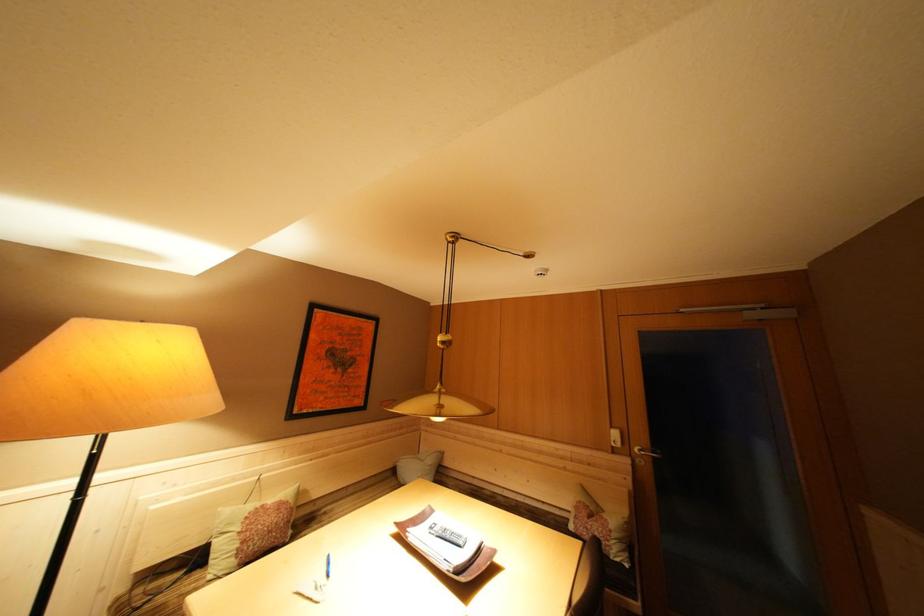
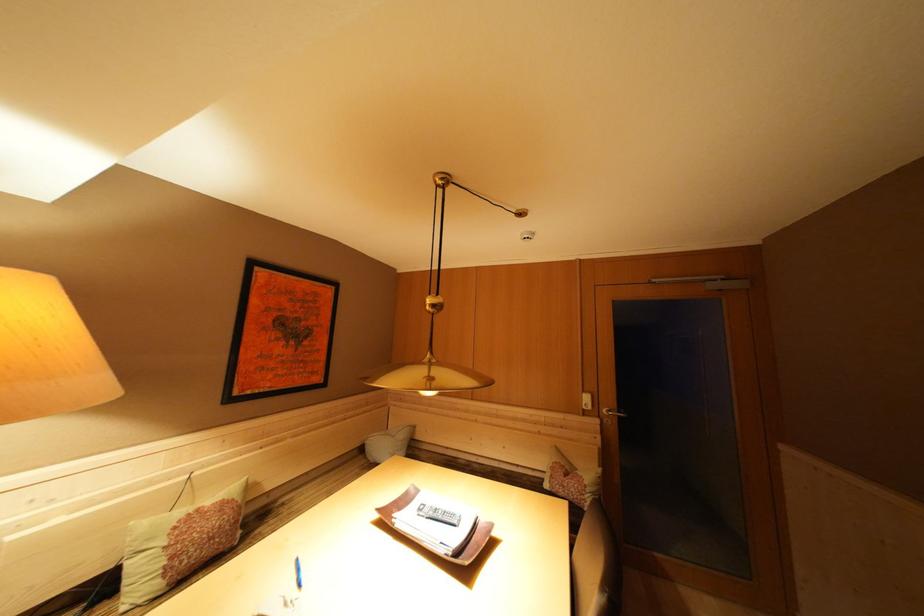
In a continuous first-person perspective shot, in which direction is the camera moving?

The cameraman walked toward left, forward.